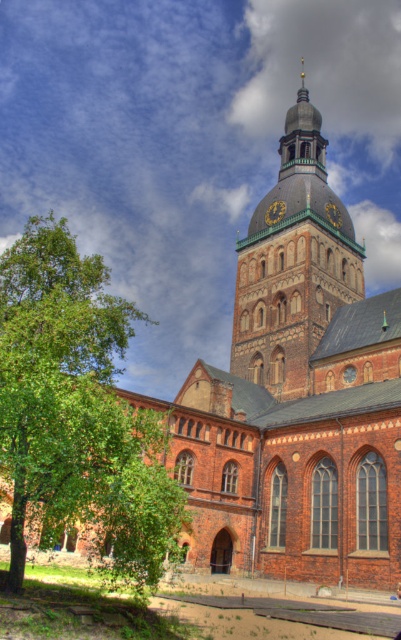
You are standing in front of the historic brick church and notice the green leafy tree at lower left and the gold metallic clock at upper center. Which object is closer to you from your current position?

The green leafy tree at lower left is closer to you because it is in front of the gold metallic clock at upper center.

You are a maintenance worker needing to replace the batteries in both the gold metallic clock at upper center and the gold textured clock at center. If your ladder can extend up to 20 feet, can you safely reach both clocks without moving the ladder?

The gold metallic clock at upper center and gold textured clock at center are 22.74 feet apart, so the ladder cannot reach both clocks since its maximum extension is only 20 feet.